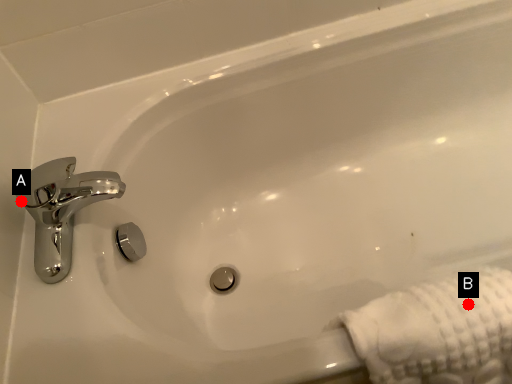
Question: Two points are circled on the image, labeled by A and B beside each circle. Which of the following is the farthest from the observer?

Choices:
 (A) A is further
 (B) B is further

Answer: (A)